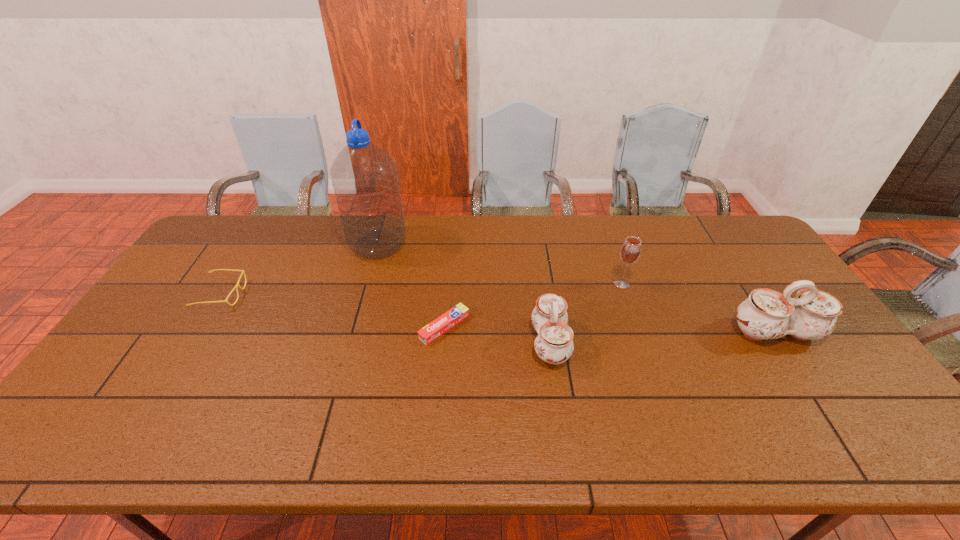
At what (x,y) coordinates should I click in order to perform the action: click on vacant area between the fifth object from left to right and the left chinaware. Please return your answer as a coordinate pair (x, y). The height and width of the screenshot is (540, 960). Looking at the image, I should click on (586, 313).

Where is `vacant point located between the farthest object and the leftmost object`? This screenshot has height=540, width=960. vacant point located between the farthest object and the leftmost object is located at coordinates pos(300,270).

The image size is (960, 540). Find the location of `unoccupied position between the right chinaware and the shortest object`. unoccupied position between the right chinaware and the shortest object is located at coordinates (610, 329).

This screenshot has height=540, width=960. What are the coordinates of `free area in between the second object from right to left and the shortest object` in the screenshot? It's located at click(x=533, y=305).

Image resolution: width=960 pixels, height=540 pixels. I want to click on the fifth closest object relative to the fifth object from left to right, so click(x=237, y=285).

What are the coordinates of `object that can be found as the second closest to the shortest object` in the screenshot? It's located at (365, 180).

Find the location of `vacant space that satisfies the following two spatial constraints: 1. by the handle of the right chinaware; 2. by the handle of the left chinaware`. vacant space that satisfies the following two spatial constraints: 1. by the handle of the right chinaware; 2. by the handle of the left chinaware is located at coordinates (781, 343).